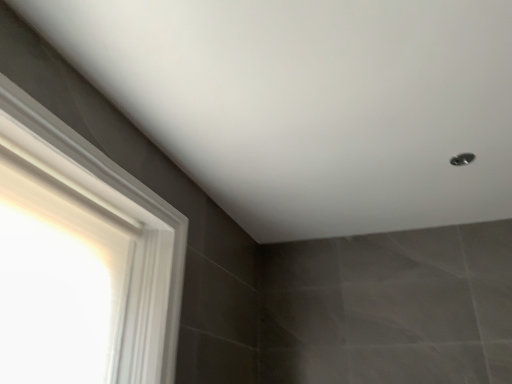
What do you see at coordinates (81, 258) in the screenshot?
I see `white glossy frame at left` at bounding box center [81, 258].

Find the location of `white glossy frame at left`. white glossy frame at left is located at coordinates (81, 258).

Describe the element at coordinates (462, 159) in the screenshot. I see `metallic silver shower at upper right` at that location.

You are a GUI agent. You are given a task and a screenshot of the screen. Output one action in this format:
    pyautogui.click(x=<x>, y=<y>)
    Task: Click on the metallic silver shower at upper right
    
    Given the screenshot: What is the action you would take?
    pyautogui.click(x=462, y=159)

Locate an element on the screen. white glossy frame at left is located at coordinates point(81,258).

Between metallic silver shower at upper right and white glossy frame at left, which one appears on the right side from the viewer's perspective?

From the viewer's perspective, metallic silver shower at upper right appears more on the right side.

Between metallic silver shower at upper right and white glossy frame at left, which one is positioned in front?

white glossy frame at left is in front.

Which point is more distant from viewer, (467, 156) or (143, 324)?

Point (467, 156)

From the image's perspective, which is below, metallic silver shower at upper right or white glossy frame at left?

white glossy frame at left.

From a real-world perspective, is metallic silver shower at upper right located beneath white glossy frame at left?

No.

Looking at their sizes, would you say metallic silver shower at upper right is wider or thinner than white glossy frame at left?

In the image, metallic silver shower at upper right appears to be more narrow than white glossy frame at left.

Who is shorter, metallic silver shower at upper right or white glossy frame at left?

With less height is metallic silver shower at upper right.

Who is smaller, metallic silver shower at upper right or white glossy frame at left?

metallic silver shower at upper right.

Is white glossy frame at left surrounded by metallic silver shower at upper right?

Definitely not — white glossy frame at left is not inside metallic silver shower at upper right.

Is there a large distance between metallic silver shower at upper right and white glossy frame at left?

Yes, metallic silver shower at upper right and white glossy frame at left are quite far apart.

Is metallic silver shower at upper right turned away from white glossy frame at left?

No, metallic silver shower at upper right is not facing the opposite direction of white glossy frame at left.

Can you tell me how much metallic silver shower at upper right and white glossy frame at left differ in facing direction?

They differ by 88.8 degrees in their facing directions.

This screenshot has height=384, width=512. What are the coordinates of `shower on the right of white glossy frame at left` in the screenshot? It's located at (462, 159).

Considering the relative positions of white glossy frame at left and metallic silver shower at upper right in the image provided, is white glossy frame at left to the right of metallic silver shower at upper right from the viewer's perspective?

No, white glossy frame at left is not to the right of metallic silver shower at upper right.

Which is behind, white glossy frame at left or metallic silver shower at upper right?

metallic silver shower at upper right is behind.

Is point (69, 380) positioned before point (475, 156)?

Yes, it is.

From the image's perspective, relative to metallic silver shower at upper right, is white glossy frame at left above or below?

white glossy frame at left is situated lower than metallic silver shower at upper right in the image.

From a real-world perspective, is white glossy frame at left located beneath metallic silver shower at upper right?

Yes, from a real-world perspective, white glossy frame at left is below metallic silver shower at upper right.

Which object is wider, white glossy frame at left or metallic silver shower at upper right?

white glossy frame at left.

Is white glossy frame at left taller than metallic silver shower at upper right?

Yes.

In terms of size, does white glossy frame at left appear bigger or smaller than metallic silver shower at upper right?

Clearly, white glossy frame at left is larger in size than metallic silver shower at upper right.

Is white glossy frame at left situated inside metallic silver shower at upper right or outside?

white glossy frame at left is not inside metallic silver shower at upper right, it's outside.

Is white glossy frame at left far away from metallic silver shower at upper right?

That's right, there is a large distance between white glossy frame at left and metallic silver shower at upper right.

Is metallic silver shower at upper right at the back of white glossy frame at left?

No, metallic silver shower at upper right is not at the back of white glossy frame at left.

How distant is white glossy frame at left from metallic silver shower at upper right?

white glossy frame at left and metallic silver shower at upper right are 4.45 feet apart.

Locate an element on the screen. The image size is (512, 384). shower that appears behind the white glossy frame at left is located at coordinates (462, 159).

Locate an element on the screen. The height and width of the screenshot is (384, 512). window located in front of the metallic silver shower at upper right is located at coordinates point(81,258).

You are a GUI agent. You are given a task and a screenshot of the screen. Output one action in this format:
    pyautogui.click(x=<x>, y=<y>)
    Task: Click on the window located on the left of metallic silver shower at upper right
    The image size is (512, 384).
    Given the screenshot: What is the action you would take?
    pyautogui.click(x=81, y=258)